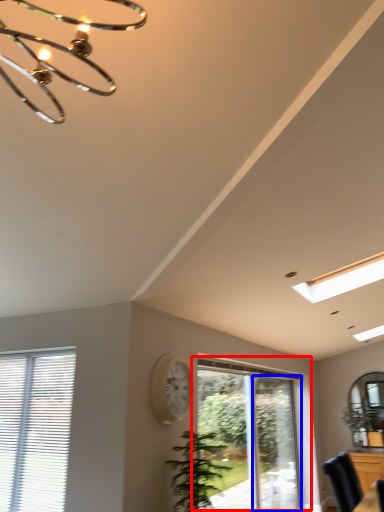
Question: Which point is closer to the camera, window (highlighted by a red box) or screen door (highlighted by a blue box)?

Choices:
 (A) window
 (B) screen door

Answer: (A)